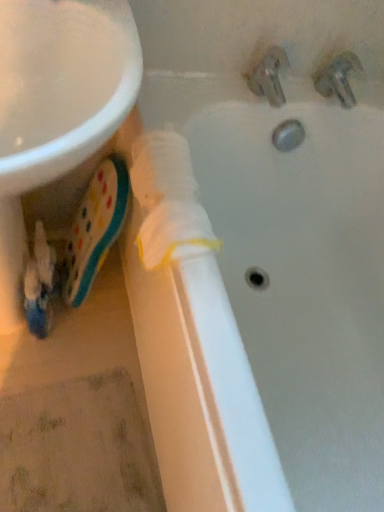
Find the location of a particular element. metallic chrome faucet at upper right, the second tap viewed from the right is located at coordinates (269, 76).

Is metallic silver tap at upper right, marked as the 1th tap in a right-to-left arrangement, facing towards white matte pipe at center?

No, metallic silver tap at upper right, marked as the 1th tap in a right-to-left arrangement, does not turn towards white matte pipe at center.

Does point (339, 92) appear closer or farther from the camera than point (379, 287)?

Point (339, 92).

Is metallic silver tap at upper right, the 2th tap when ordered from left to right, at the right side of white matte pipe at center?

Indeed, metallic silver tap at upper right, the 2th tap when ordered from left to right, is positioned on the right side of white matte pipe at center.

Would you consider metallic silver tap at upper right, marked as the 1th tap in a right-to-left arrangement, to be distant from white matte pipe at center?

No, metallic silver tap at upper right, marked as the 1th tap in a right-to-left arrangement, is not far away from white matte pipe at center.

Is metallic silver tap at upper right, the 2th tap when ordered from left to right, oriented towards matte plastic toothpaste at lower left?

No, metallic silver tap at upper right, the 2th tap when ordered from left to right, is not turned towards matte plastic toothpaste at lower left.

Is metallic silver tap at upper right, the 2th tap when ordered from left to right, further to camera compared to matte plastic toothpaste at lower left?

Yes, the depth of metallic silver tap at upper right, the 2th tap when ordered from left to right, is greater than that of matte plastic toothpaste at lower left.

Does point (327, 95) appear closer or farther from the camera than point (79, 258)?

Point (327, 95) is positioned closer to the camera compared to point (79, 258).

How far apart are metallic silver tap at upper right, marked as the 1th tap in a right-to-left arrangement, and matte plastic toothpaste at lower left?

metallic silver tap at upper right, marked as the 1th tap in a right-to-left arrangement, and matte plastic toothpaste at lower left are 24.94 inches apart.

Can you tell me how much matte plastic toothpaste at lower left and metallic chrome faucet at upper right, the second tap viewed from the right, differ in facing direction?

10.5 degrees.

Is point (89, 267) positioned before point (274, 77)?

No, it is not.

Looking at this image, is the position of matte plastic toothpaste at lower left less distant than that of metallic chrome faucet at upper right, the second tap viewed from the right?

Yes, it is in front of metallic chrome faucet at upper right, the second tap viewed from the right.

Is matte plastic toothpaste at lower left oriented away from metallic chrome faucet at upper right, the second tap viewed from the right?

matte plastic toothpaste at lower left is not turned away from metallic chrome faucet at upper right, the second tap viewed from the right.

Does point (326, 85) lie behind point (253, 78)?

Yes, point (326, 85) is farther from viewer.

Based on their positions, is metallic silver tap at upper right, marked as the 1th tap in a right-to-left arrangement, located to the left or right of metallic chrome faucet at upper right, the second tap viewed from the right?

Based on their positions, metallic silver tap at upper right, marked as the 1th tap in a right-to-left arrangement, is located to the right of metallic chrome faucet at upper right, the second tap viewed from the right.

You are a GUI agent. You are given a task and a screenshot of the screen. Output one action in this format:
    pyautogui.click(x=<x>, y=<y>)
    Task: Click on the tap below the metallic silver tap at upper right, marked as the 1th tap in a right-to-left arrangement (from the image's perspective)
    
    Given the screenshot: What is the action you would take?
    pyautogui.click(x=269, y=76)

Considering the sizes of objects matte plastic toothpaste at lower left and metallic silver tap at upper right, marked as the 1th tap in a right-to-left arrangement, in the image provided, who is thinner, matte plastic toothpaste at lower left or metallic silver tap at upper right, marked as the 1th tap in a right-to-left arrangement,?

Thinner between the two is metallic silver tap at upper right, marked as the 1th tap in a right-to-left arrangement.

Is matte plastic toothpaste at lower left next to metallic silver tap at upper right, the 2th tap when ordered from left to right, and touching it?

No, matte plastic toothpaste at lower left is not next to metallic silver tap at upper right, the 2th tap when ordered from left to right.

Which is behind, point (105, 242) or point (320, 91)?

The point (105, 242) is behind.

Is matte plastic toothpaste at lower left spatially inside metallic silver tap at upper right, marked as the 1th tap in a right-to-left arrangement, or outside of it?

matte plastic toothpaste at lower left is spatially situated outside metallic silver tap at upper right, marked as the 1th tap in a right-to-left arrangement.

From the matte plastic toothpaste at lower left, count 1st tap to the right and point to it. Please provide its 2D coordinates.

[(269, 76)]

Who is taller, metallic chrome faucet at upper right, which is counted as the 1th tap, starting from the left, or matte plastic toothpaste at lower left?

Standing taller between the two is matte plastic toothpaste at lower left.

Which is more to the left, metallic chrome faucet at upper right, the second tap viewed from the right, or matte plastic toothpaste at lower left?

Positioned to the left is matte plastic toothpaste at lower left.

Is point (269, 48) behind point (105, 217)?

No, it is not.

Which object is more forward, matte plastic toothpaste at lower left or white matte pipe at center?

white matte pipe at center.

Could you tell me if matte plastic toothpaste at lower left is turned towards white matte pipe at center?

No, matte plastic toothpaste at lower left is not turned towards white matte pipe at center.

Does matte plastic toothpaste at lower left have a smaller size compared to white matte pipe at center?

Indeed, matte plastic toothpaste at lower left has a smaller size compared to white matte pipe at center.

Would you say matte plastic toothpaste at lower left is to the left or to the right of white matte pipe at center in the picture?

matte plastic toothpaste at lower left is to the left of white matte pipe at center.

This screenshot has width=384, height=512. I want to click on bathtub to the left of metallic silver tap at upper right, marked as the 1th tap in a right-to-left arrangement, so click(x=290, y=218).

You are a GUI agent. You are given a task and a screenshot of the screen. Output one action in this format:
    pyautogui.click(x=<x>, y=<y>)
    Task: Click on the 2nd tap to the right when counting from the matte plastic toothpaste at lower left
    This screenshot has width=384, height=512.
    Given the screenshot: What is the action you would take?
    pyautogui.click(x=338, y=78)

Looking at the image, which one is located closer to white matte pipe at center, matte plastic toothpaste at lower left or metallic chrome faucet at upper right, the second tap viewed from the right?

Based on the image, metallic chrome faucet at upper right, the second tap viewed from the right, appears to be nearer to white matte pipe at center.

From the image, which object appears to be farther from white matte pipe at center, metallic chrome faucet at upper right, the second tap viewed from the right, or matte plastic toothpaste at lower left?

matte plastic toothpaste at lower left is further to white matte pipe at center.

Consider the image. Based on their spatial positions, is white matte pipe at center or matte plastic toothpaste at lower left closer to metallic silver tap at upper right, the 2th tap when ordered from left to right?

white matte pipe at center.

Looking at this image, when comparing their distances from metallic chrome faucet at upper right, the second tap viewed from the right, does matte plastic toothpaste at lower left or white matte pipe at center seem closer?

Based on the image, white matte pipe at center appears to be nearer to metallic chrome faucet at upper right, the second tap viewed from the right.

From the image, which object appears to be nearer to matte plastic toothpaste at lower left, metallic silver tap at upper right, marked as the 1th tap in a right-to-left arrangement, or white matte pipe at center?

white matte pipe at center is closer to matte plastic toothpaste at lower left.

When comparing their distances from white matte pipe at center, does metallic chrome faucet at upper right, the second tap viewed from the right, or metallic silver tap at upper right, marked as the 1th tap in a right-to-left arrangement, seem further?

metallic chrome faucet at upper right, the second tap viewed from the right.

Considering their positions, is metallic silver tap at upper right, marked as the 1th tap in a right-to-left arrangement, positioned further to white matte pipe at center than matte plastic toothpaste at lower left?

matte plastic toothpaste at lower left lies further to white matte pipe at center than the other object.

From the image, which object appears to be nearer to metallic chrome faucet at upper right, which is counted as the 1th tap, starting from the left, metallic silver tap at upper right, marked as the 1th tap in a right-to-left arrangement, or white matte pipe at center?

metallic silver tap at upper right, marked as the 1th tap in a right-to-left arrangement, is closer to metallic chrome faucet at upper right, which is counted as the 1th tap, starting from the left.

Find the location of a particular element. Image resolution: width=384 pixels, height=512 pixels. tap between matte plastic toothpaste at lower left and white matte pipe at center from left to right is located at coordinates (269, 76).

What are the coordinates of `tap located between matte plastic toothpaste at lower left and metallic silver tap at upper right, marked as the 1th tap in a right-to-left arrangement, in the left-right direction` in the screenshot? It's located at (269, 76).

Locate an element on the screen. This screenshot has width=384, height=512. tap between metallic silver tap at upper right, marked as the 1th tap in a right-to-left arrangement, and white matte pipe at center from top to bottom is located at coordinates (269, 76).

Where is `bathtub situated between matte plastic toothpaste at lower left and metallic silver tap at upper right, the 2th tap when ordered from left to right, from left to right`? The height and width of the screenshot is (512, 384). bathtub situated between matte plastic toothpaste at lower left and metallic silver tap at upper right, the 2th tap when ordered from left to right, from left to right is located at coordinates (290, 218).